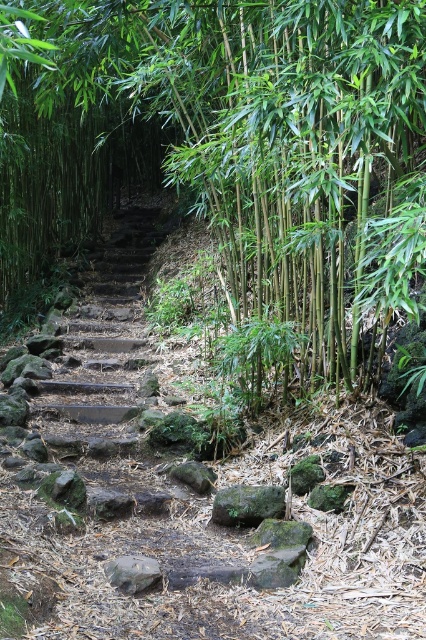
Is green bamboo at center below smooth gray rock at center?

Actually, green bamboo at center is above smooth gray rock at center.

Is green bamboo at center bigger than smooth gray rock at center?

Yes, green bamboo at center is bigger than smooth gray rock at center.

You are a GUI agent. You are given a task and a screenshot of the screen. Output one action in this format:
    pyautogui.click(x=<x>, y=<y>)
    Task: Click on the green bamboo at center
    The image size is (426, 640).
    Given the screenshot: What is the action you would take?
    pyautogui.click(x=279, y=147)

This screenshot has width=426, height=640. I want to click on green bamboo at center, so click(279, 147).

Which is more to the left, green bamboo at center or green mossy rock at center?

From the viewer's perspective, green mossy rock at center appears more on the left side.

Between green bamboo at center and green mossy rock at center, which one appears on the right side from the viewer's perspective?

green bamboo at center is more to the right.

I want to click on green bamboo at center, so click(279, 147).

Can you confirm if green mossy rock at center is positioned to the left of smooth gray rock at center?

Incorrect, green mossy rock at center is not on the left side of smooth gray rock at center.

Can you confirm if green mossy rock at center is smaller than smooth gray rock at center?

Incorrect, green mossy rock at center is not smaller in size than smooth gray rock at center.

Is point (218, 516) positioned behind point (198, 492)?

That is False.

Identify the location of green mossy rock at center. (247, 504).